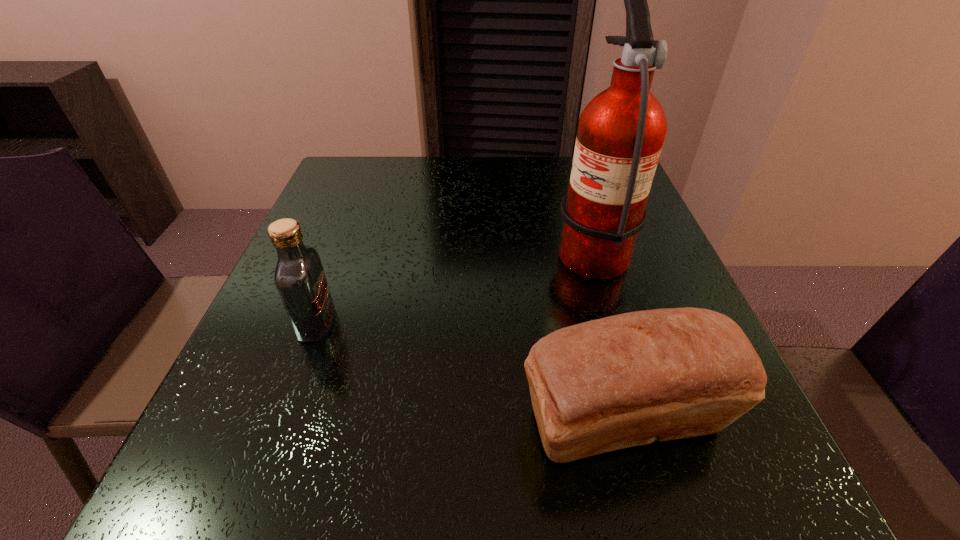
The width and height of the screenshot is (960, 540). Find the location of `fire extinguisher`. fire extinguisher is located at coordinates (621, 131).

Find the location of a particular element. The height and width of the screenshot is (540, 960). the tallest object is located at coordinates (621, 131).

The image size is (960, 540). What are the coordinates of `the leftmost object` in the screenshot? It's located at [x=299, y=276].

Locate an element on the screen. The image size is (960, 540). the second farthest object is located at coordinates click(x=299, y=276).

Identify the location of bread. The height and width of the screenshot is (540, 960). (626, 380).

Find the location of `the shortest object`. the shortest object is located at coordinates (626, 380).

Where is `vacant space positioned 0.320m on the nozzle and handle of the fire extinguisher`? vacant space positioned 0.320m on the nozzle and handle of the fire extinguisher is located at coordinates (403, 246).

Where is `free space located 0.280m on the nozzle and handle of the fire extinguisher`? Image resolution: width=960 pixels, height=540 pixels. free space located 0.280m on the nozzle and handle of the fire extinguisher is located at coordinates (421, 246).

Where is `vacant space located on the nozzle and handle of the fire extinguisher`? vacant space located on the nozzle and handle of the fire extinguisher is located at coordinates (384, 246).

This screenshot has width=960, height=540. Identify the location of free space located on the front-facing side of the vodka. (368, 323).